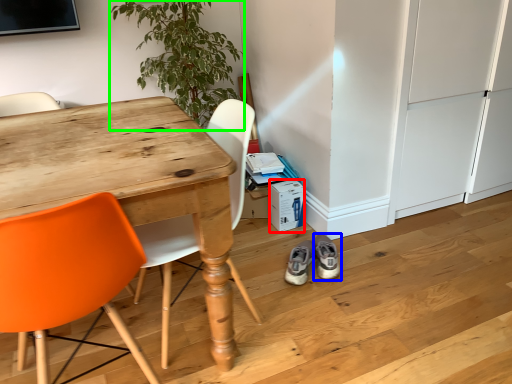
Question: Which is nearer to the box (highlighted by a red box)? footwear (highlighted by a blue box) or houseplant (highlighted by a green box).

Choices:
 (A) footwear
 (B) houseplant

Answer: (A)